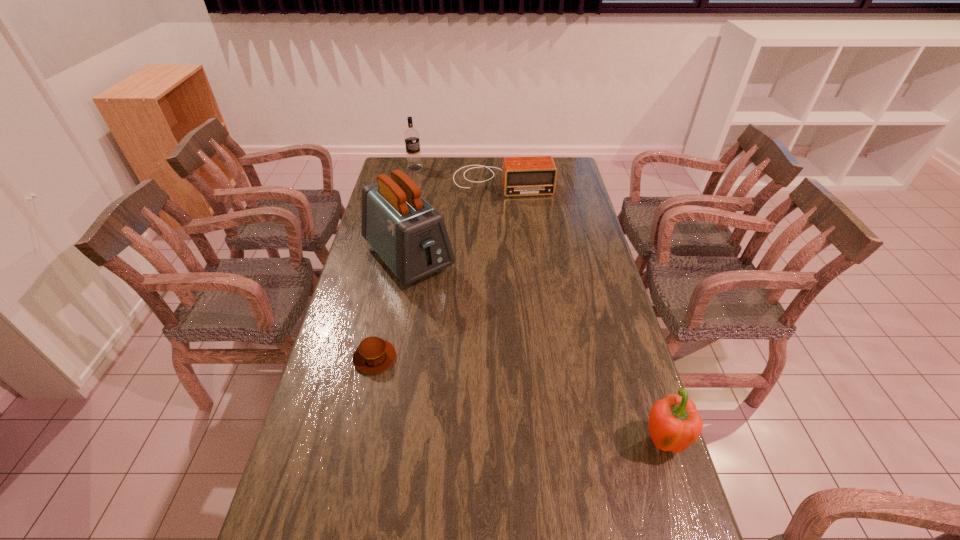
The height and width of the screenshot is (540, 960). Identify the location of muffin. (374, 355).

Identify the location of the fourth farthest object. Image resolution: width=960 pixels, height=540 pixels. coord(374,355).

What are the coordinates of `the rightmost object` in the screenshot? It's located at (674, 424).

Locate an element on the screen. The height and width of the screenshot is (540, 960). the nearest object is located at coordinates (674, 424).

Locate an element on the screen. This screenshot has width=960, height=540. the second tallest object is located at coordinates tap(411, 136).

Locate an element on the screen. Image resolution: width=960 pixels, height=540 pixels. the tallest object is located at coordinates (410, 236).

I want to click on toaster, so pyautogui.click(x=410, y=236).

This screenshot has width=960, height=540. What are the coordinates of `radio receiver` in the screenshot? It's located at [x=521, y=176].

The height and width of the screenshot is (540, 960). I want to click on vacant space situated 0.300m on the right of the shortest object, so click(496, 357).

Identify the location of vacant region located on the left of the nearest object. (491, 442).